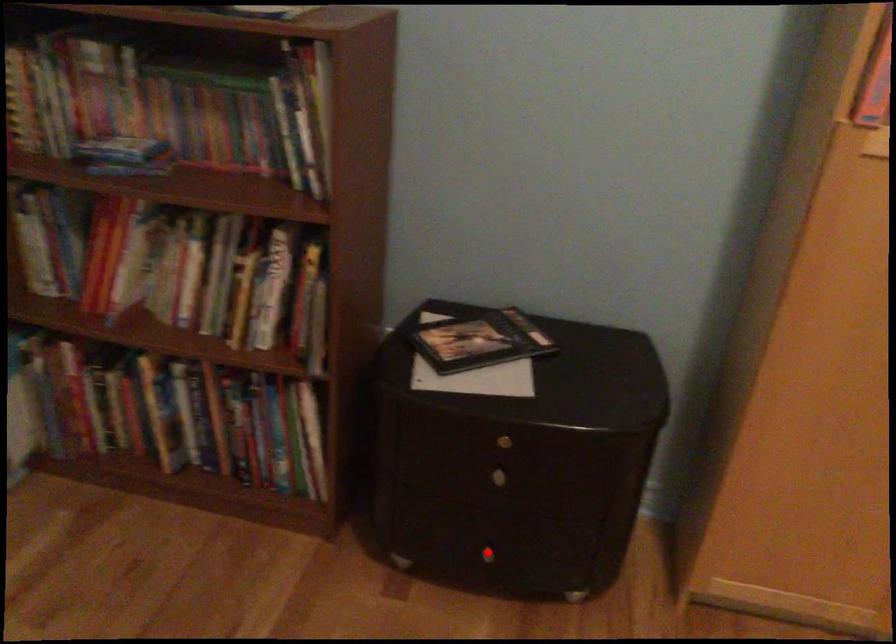
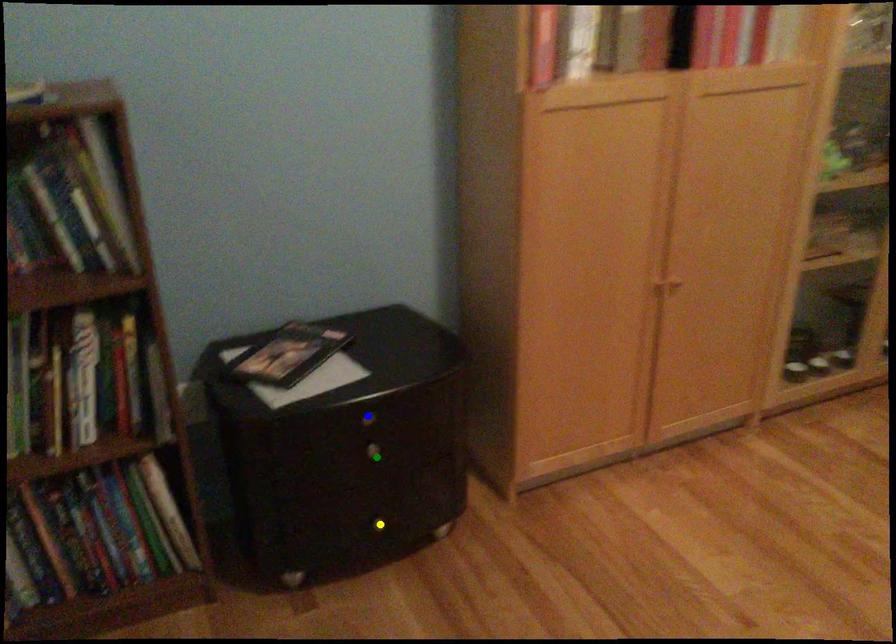
Question: I am providing you with two images of the same scene from different viewpoints. A red point is marked on the first image. You are given multiple points on the second image. In image 2, which mark is for the same physical point as the one in image 1?

Choices:
 (A) yellow point
 (B) green point
 (C) blue point

Answer: (A)